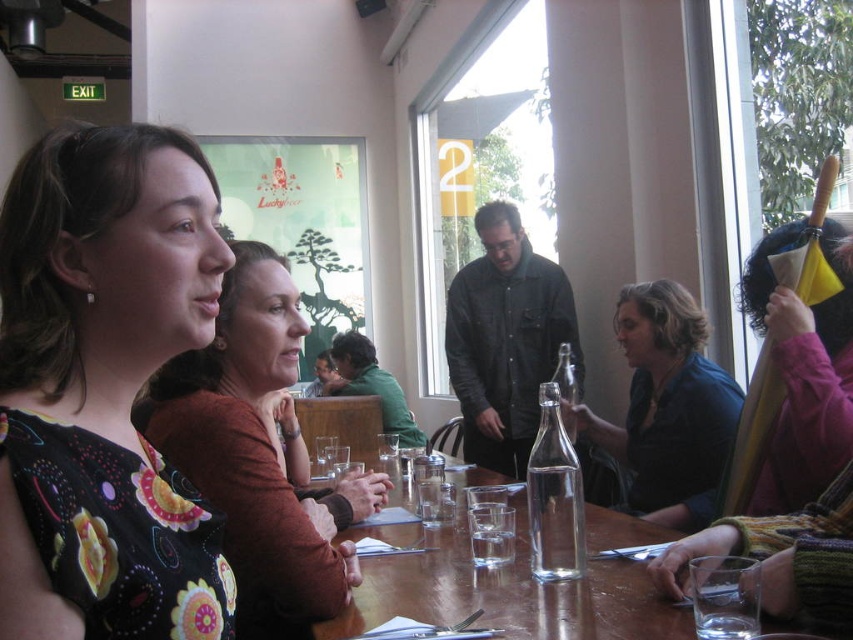
Which is more to the right, floral print dress at center or wooden table at center?

wooden table at center is more to the right.

Can you confirm if floral print dress at center is positioned above wooden table at center?

Correct, floral print dress at center is located above wooden table at center.

Which is behind, point (97, 372) or point (393, 579)?

Point (393, 579)

Find the location of a particular element. The height and width of the screenshot is (640, 853). floral print dress at center is located at coordinates pos(103,380).

Which is in front, point (108, 500) or point (257, 320)?

Point (108, 500) is in front.

Based on the photo, who is higher up, floral print dress at center or floral dress at center?

floral print dress at center is above.

Does point (74, 540) lie in front of point (175, 369)?

Yes.

Find the location of a particular element. Image resolution: width=853 pixels, height=640 pixels. floral print dress at center is located at coordinates (103, 380).

Is floral dress at center positioned behind wooden table at center?

That is False.

Who is positioned more to the right, floral dress at center or wooden table at center?

wooden table at center is more to the right.

What do you see at coordinates (254, 451) in the screenshot? I see `floral dress at center` at bounding box center [254, 451].

Locate an element on the screen. Image resolution: width=853 pixels, height=640 pixels. floral dress at center is located at coordinates (254, 451).